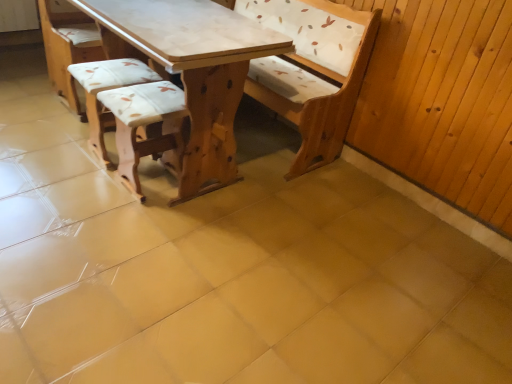
Question: From a real-world perspective, relative to wooden textured stool at center, which is the first armchair in right-to-left order, is light brown wood table at center vertically above or below?

Choices:
 (A) below
 (B) above

Answer: (B)

Question: Is light brown wood table at center to the left or to the right of wooden textured stool at center, the second armchair positioned from the left, in the image?

Choices:
 (A) left
 (B) right

Answer: (B)

Question: Estimate the real-world distances between objects in this image. Which object is farther from the white fabric cushion at center, the first armchair in the left-to-right sequence?

Choices:
 (A) wooden textured stool at center, which is the first armchair in right-to-left order
 (B) light brown wood table at center

Answer: (B)

Question: Which is nearer to the white fabric cushion at center, positioned as the 2th armchair in right-to-left order?

Choices:
 (A) light brown wood table at center
 (B) wooden textured stool at center, the second armchair positioned from the left

Answer: (B)